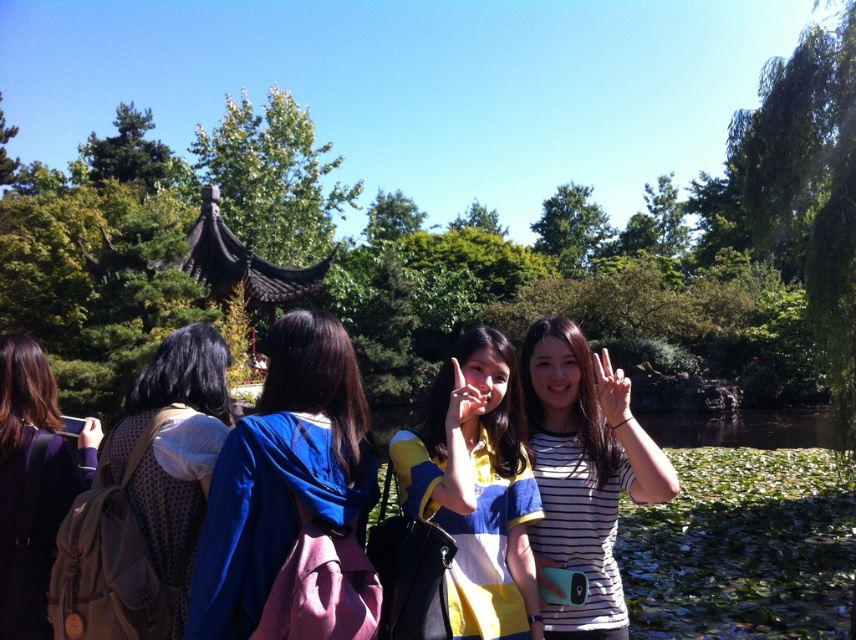
Based on the photo, is dark purple hoodie at center closer to camera compared to matte plastic phone at center?

No, dark purple hoodie at center is behind matte plastic phone at center.

The image size is (856, 640). In order to click on dark purple hoodie at center in this screenshot , I will do `click(31, 484)`.

Which of these two, brown textured backpack at left or matte plastic phone at center, stands shorter?

matte plastic phone at center

Which is more to the left, brown textured backpack at left or matte plastic phone at center?

From the viewer's perspective, brown textured backpack at left appears more on the left side.

Measure the distance between brown textured backpack at left and camera.

2.42 meters

Where is `brown textured backpack at left`? brown textured backpack at left is located at coordinates (174, 449).

Is point (207, 422) farther from viewer compared to point (599, 358)?

No, it is in front of (599, 358).

Does brown textured backpack at left have a lesser height compared to white matte hand at center?

In fact, brown textured backpack at left may be taller than white matte hand at center.

Image resolution: width=856 pixels, height=640 pixels. I want to click on brown textured backpack at left, so click(174, 449).

The width and height of the screenshot is (856, 640). I want to click on brown textured backpack at left, so click(x=174, y=449).